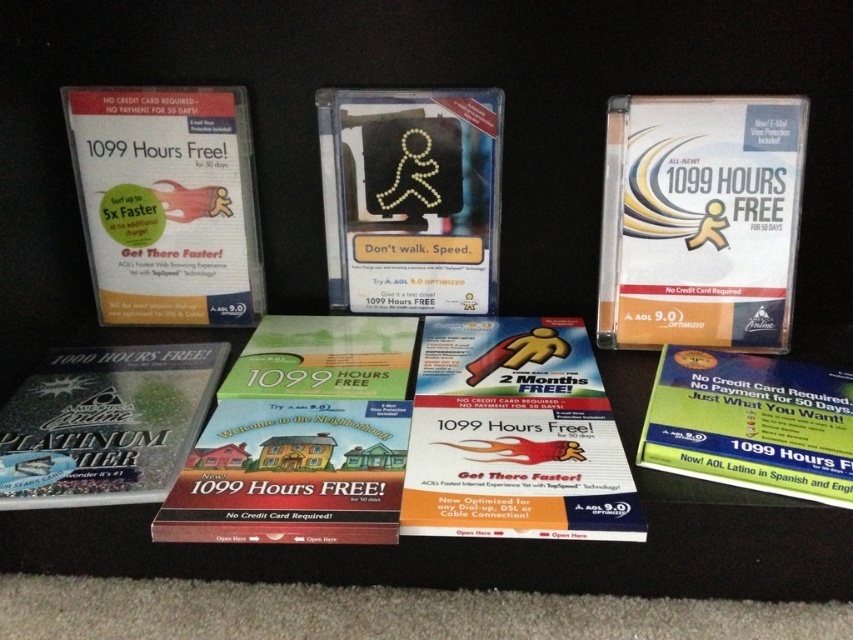
Does white glossy cd at upper center have a larger size compared to matte plastic booklet at center?

Incorrect, white glossy cd at upper center is not larger than matte plastic booklet at center.

Is white glossy cd at upper center to the left of matte plastic booklet at center from the viewer's perspective?

No, white glossy cd at upper center is not to the left of matte plastic booklet at center.

Identify the location of white glossy cd at upper center. Image resolution: width=853 pixels, height=640 pixels. (700, 221).

Is white glossy cd at upper center smaller than green matte book at center?

Correct, white glossy cd at upper center occupies less space than green matte book at center.

Measure the distance from white glossy cd at upper center to green matte book at center.

The distance of white glossy cd at upper center from green matte book at center is 17.66 inches.

In order to click on white glossy cd at upper center in this screenshot , I will do `click(700, 221)`.

Which is in front, point (434, 445) or point (743, 403)?

Positioned in front is point (434, 445).

Is matte plastic booklet at center wider than green matte book at lower right?

No.

Does point (602, 468) lie behind point (831, 412)?

No, (602, 468) is in front of (831, 412).

Identify the location of matte plastic booklet at center. (514, 435).